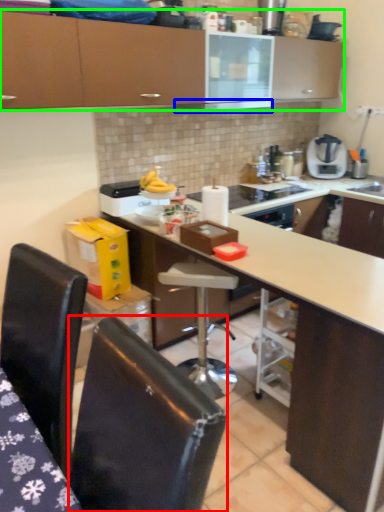
Question: Which object is the closest to the chair (highlighted by a red box)? Choose among these: exhaust hood (highlighted by a blue box) or cabinetry (highlighted by a green box).

Choices:
 (A) exhaust hood
 (B) cabinetry

Answer: (B)